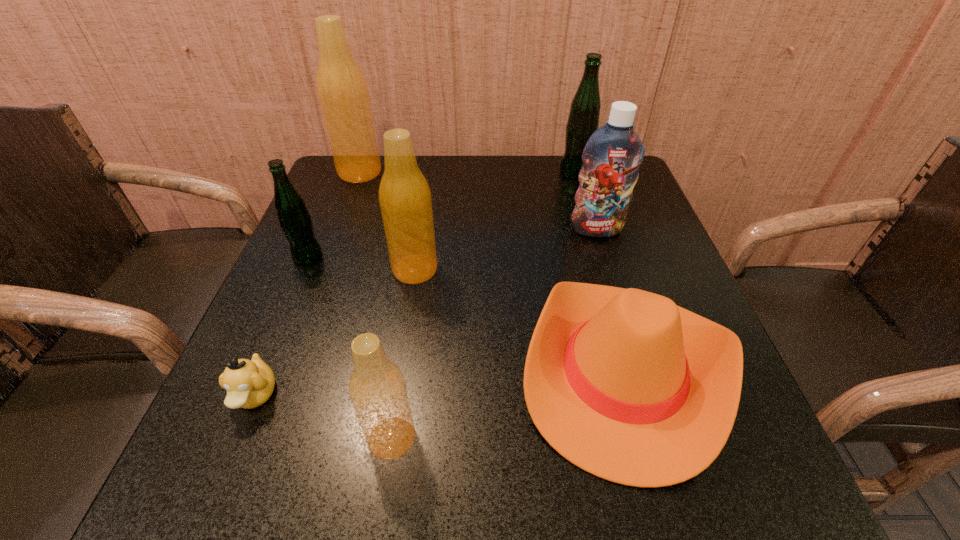
What are the coordinates of `object situated at the near right corner` in the screenshot? It's located at [623, 383].

The image size is (960, 540). Identify the location of free spot at the far edge of the desktop. (540, 184).

Find the location of a particular element. This screenshot has height=540, width=960. vacant space at the near edge is located at coordinates (420, 486).

This screenshot has width=960, height=540. In order to click on vacant area at the left edge in this screenshot , I will do `click(281, 322)`.

Where is `vacant space at the right edge of the desktop`? The width and height of the screenshot is (960, 540). vacant space at the right edge of the desktop is located at coordinates (653, 240).

In the image, there is a desktop. Where is `vacant space at the near left corner`? The width and height of the screenshot is (960, 540). vacant space at the near left corner is located at coordinates (202, 445).

You are a GUI agent. You are given a task and a screenshot of the screen. Output one action in this format:
    pyautogui.click(x=<x>, y=<y>)
    Task: Click on the free spot between the tan duckling and the nearest tan beer bottle
    
    Given the screenshot: What is the action you would take?
    pyautogui.click(x=324, y=417)

The height and width of the screenshot is (540, 960). In order to click on free space that is in between the cowboy hat and the tan duckling in this screenshot , I will do `click(440, 383)`.

The width and height of the screenshot is (960, 540). What are the coordinates of `vacant space that's between the rightmost beer bottle and the tallest object` in the screenshot? It's located at (468, 172).

I want to click on free space between the shampoo and the duckling, so click(426, 313).